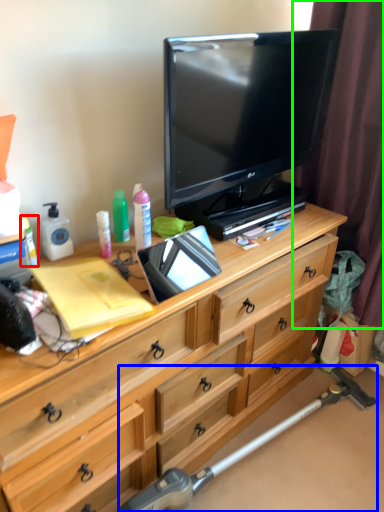
Question: Which is farther away from toiletry (highlighted by a red box)? equipment (highlighted by a blue box) or curtain (highlighted by a green box)?

Choices:
 (A) equipment
 (B) curtain

Answer: (B)